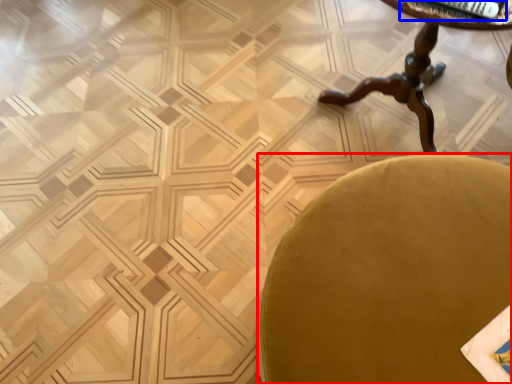
Question: Among these objects, which one is nearest to the camera, chair (highlighted by a red box) or magazine (highlighted by a blue box)?

Choices:
 (A) chair
 (B) magazine

Answer: (A)